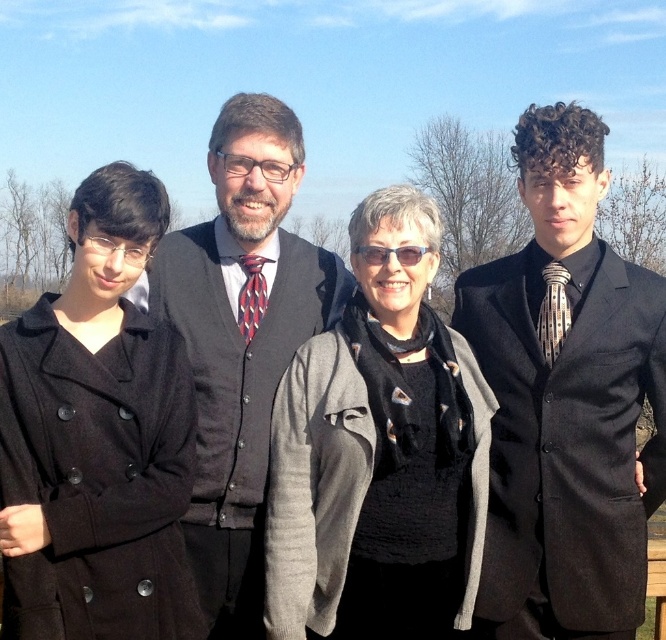
Does black textured scarf at center have a smaller size compared to matte black sweater vest at center?

Yes, black textured scarf at center is smaller than matte black sweater vest at center.

Can you confirm if black textured scarf at center is shorter than matte black sweater vest at center?

Correct, black textured scarf at center is not as tall as matte black sweater vest at center.

At what (x,y) coordinates should I click in order to perform the action: click on black textured scarf at center. Please return your answer as a coordinate pair (x, y). Looking at the image, I should click on (380, 451).

Which is behind, point (234, 424) or point (541, 305)?

Positioned behind is point (541, 305).

Does matte black sweater vest at center lie behind patterned silk tie at right?

No, matte black sweater vest at center is in front of patterned silk tie at right.

Between point (238, 403) and point (555, 323), which one is positioned in front?

Positioned in front is point (238, 403).

Identify the location of matte black sweater vest at center. The height and width of the screenshot is (640, 666). (240, 342).

Does matte black coat at left have a lesser width compared to matte black sweater vest at center?

Yes, matte black coat at left is thinner than matte black sweater vest at center.

Is matte black coat at left below matte black sweater vest at center?

Correct, matte black coat at left is located below matte black sweater vest at center.

Find the location of `matte black coat at left`. matte black coat at left is located at coordinates coord(97,438).

What are the coordinates of `matte black coat at left` in the screenshot? It's located at coord(97,438).